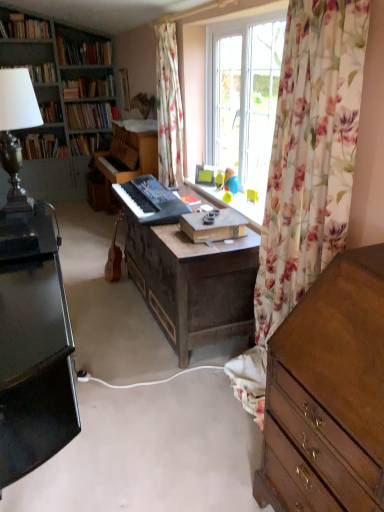
Identify the location of free spot in front of wooden desk at center. (162, 409).